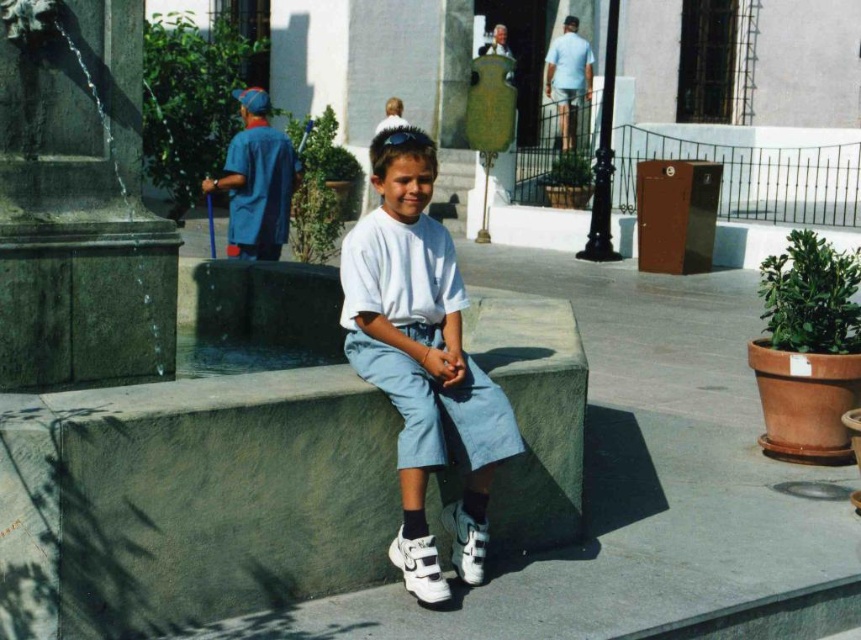
Does white leather shoe at lower center appear under white suede sneaker at lower center?

Correct, white leather shoe at lower center is located below white suede sneaker at lower center.

Who is taller, white leather shoe at lower center or white suede sneaker at lower center?

white suede sneaker at lower center is taller.

This screenshot has height=640, width=861. What do you see at coordinates (419, 566) in the screenshot? I see `white leather shoe at lower center` at bounding box center [419, 566].

What are the coordinates of `white leather shoe at lower center` in the screenshot? It's located at (419, 566).

Can you confirm if green stone pillar at left is positioned above white leather shoe at lower center?

Indeed, green stone pillar at left is positioned over white leather shoe at lower center.

Between green stone pillar at left and white leather shoe at lower center, which one is positioned lower?

white leather shoe at lower center is lower down.

This screenshot has height=640, width=861. What are the coordinates of `green stone pillar at left` in the screenshot? It's located at (79, 209).

Is white matte shorts at center shorter than white suede sneaker at lower center?

No.

Does point (430, 160) lie behind point (449, 520)?

No.

Is point (487, 412) positioned before point (475, 538)?

Yes, it is in front of point (475, 538).

At what (x,y) coordinates should I click in order to perform the action: click on white matte shorts at center. Please return your answer as a coordinate pair (x, y). This screenshot has width=861, height=640. Looking at the image, I should click on (420, 358).